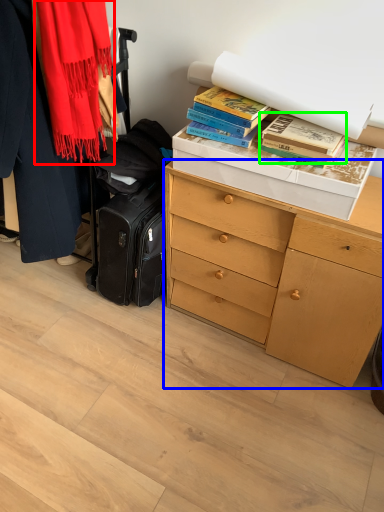
Question: Based on their relative distances, which object is nearer to scarf (highlighted by a red box)? Choose from chest of drawers (highlighted by a blue box) and book (highlighted by a green box).

Choices:
 (A) chest of drawers
 (B) book

Answer: (B)